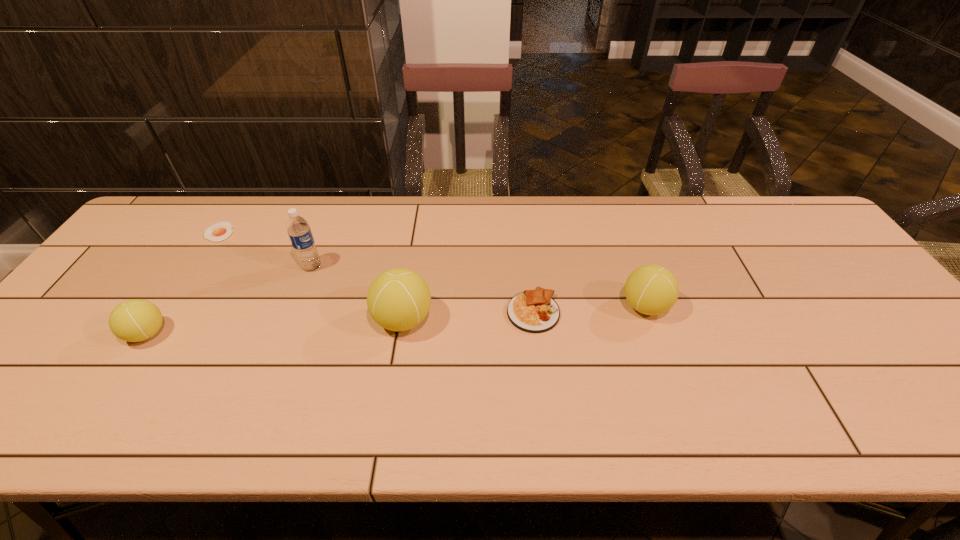
In order to click on the fifth tallest object in this screenshot , I will do `click(535, 311)`.

Identify the location of omelet. Image resolution: width=960 pixels, height=540 pixels. (535, 311).

Find the location of `vacant space located 0.360m on the right of the shortest tennis ball`. vacant space located 0.360m on the right of the shortest tennis ball is located at coordinates (316, 334).

I want to click on vacant space situated on the left of the tallest tennis ball, so 305,320.

At what (x,y) coordinates should I click in order to perform the action: click on free space located on the right of the rightmost object. Please return your answer as a coordinate pair (x, y). Looking at the image, I should click on (775, 307).

Where is `free space located 0.190m on the left of the farthest object`? The height and width of the screenshot is (540, 960). free space located 0.190m on the left of the farthest object is located at coordinates (142, 232).

Where is `vacant space located on the front of the third object from left to right`? vacant space located on the front of the third object from left to right is located at coordinates (301, 292).

Locate an element on the screen. This screenshot has height=540, width=960. free space located 0.080m on the right of the second shortest object is located at coordinates (591, 312).

At what (x,y) coordinates should I click in order to perform the action: click on object situated at the far edge. Please return your answer as a coordinate pair (x, y). The image size is (960, 540). Looking at the image, I should click on (220, 231).

Identify the location of vacant area at the far edge. The width and height of the screenshot is (960, 540). (550, 209).